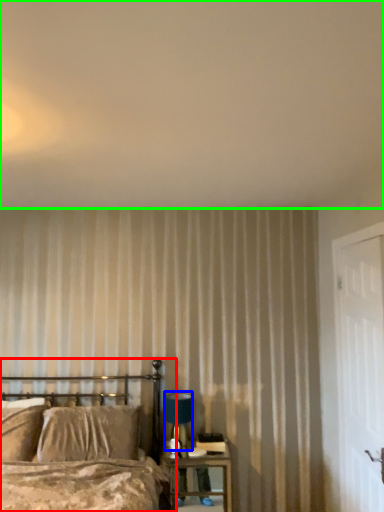
Question: Which is farther away from bed (highlighted by a red box)? table lamp (highlighted by a blue box) or backdrop (highlighted by a green box)?

Choices:
 (A) table lamp
 (B) backdrop

Answer: (B)